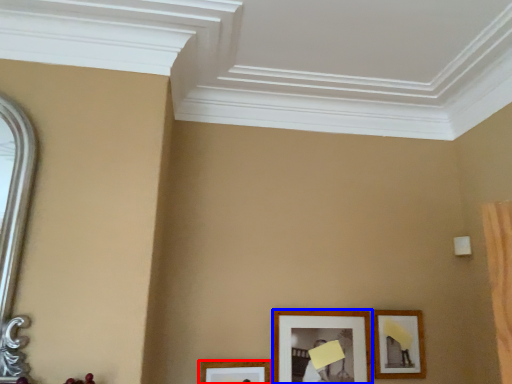
Question: Among these objects, which one is nearest to the camera, picture frame (highlighted by a red box) or picture frame (highlighted by a blue box)?

Choices:
 (A) picture frame
 (B) picture frame

Answer: (A)